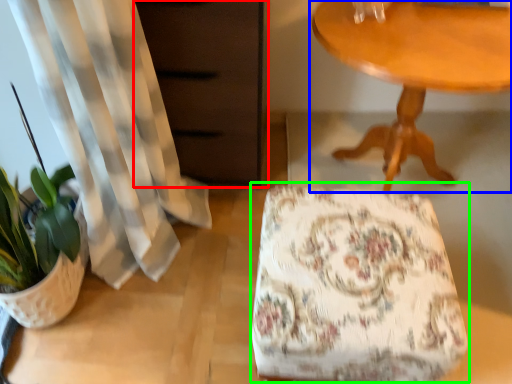
Question: Which object is the closest to the dresser (highlighted by a red box)? Choose among these: table (highlighted by a blue box) or rocking chair (highlighted by a green box).

Choices:
 (A) table
 (B) rocking chair

Answer: (A)